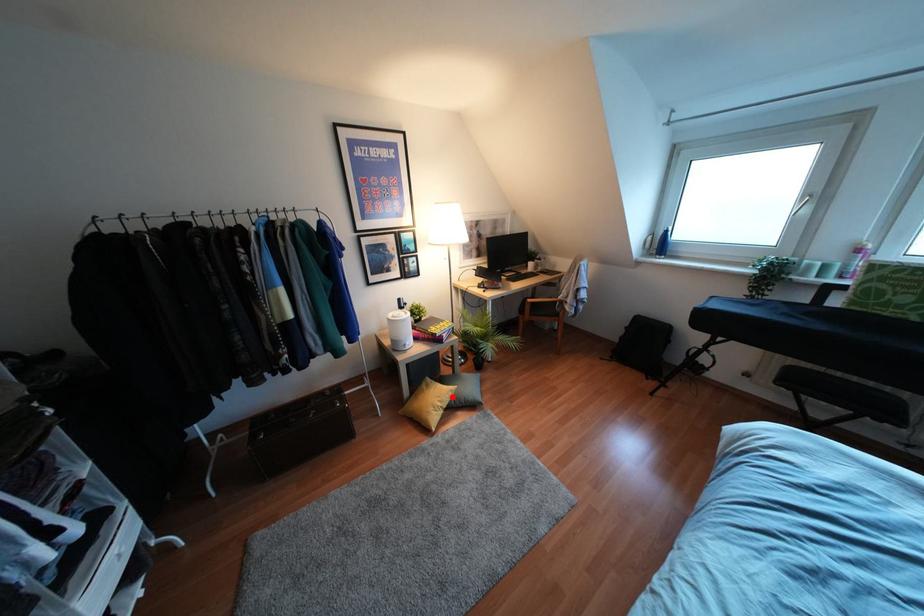
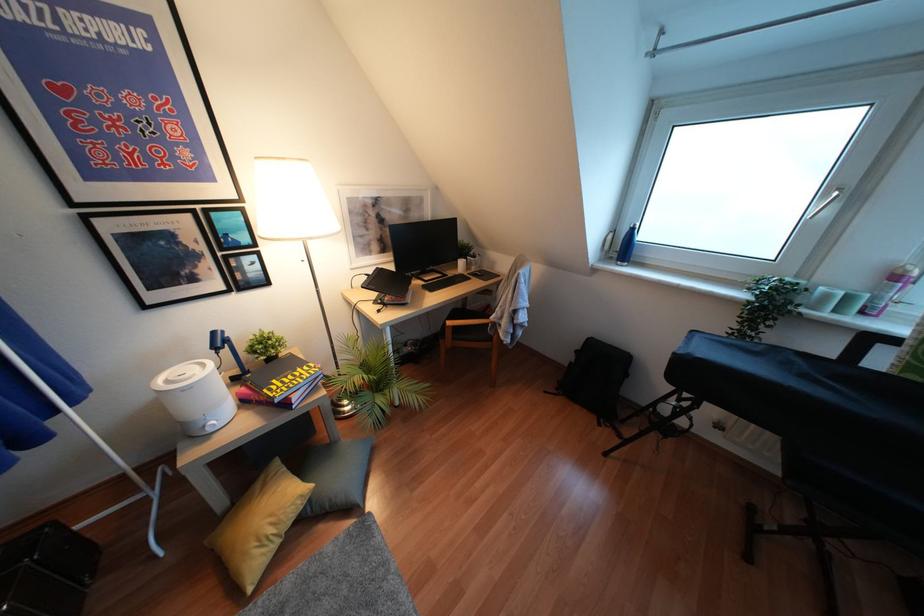
Question: I am providing you with two images of the same scene from different viewpoints. Given a red point in image1, look at the same physical point in image2. Is it:

Choices:
 (A) Closer to the viewpoint
 (B) Farther from the viewpoint

Answer: (B)